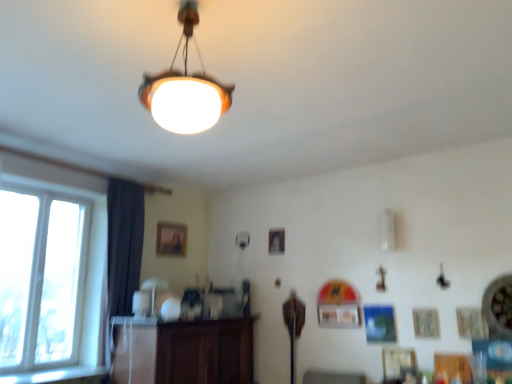
The image size is (512, 384). What do you see at coordinates (154, 289) in the screenshot? I see `matte white lampshade at center, arranged as the 2th lamp when viewed from the right` at bounding box center [154, 289].

At what (x,y) coordinates should I click in order to perform the action: click on brown wooden dresser at center. Please return your answer as a coordinate pair (x, y). This screenshot has width=512, height=384. Looking at the image, I should click on (183, 351).

Describe the element at coordinates (49, 271) in the screenshot. I see `white glass window at left` at that location.

At what (x,y) coordinates should I click in order to perform the action: click on matte glass lampshade at upper center, which is the 2th lamp from left to right. Please return your answer as a coordinate pair (x, y). Looking at the image, I should click on (185, 89).

From the picture: Can you confirm if brown wooden dresser at center is bigger than white glass window at left?

Yes, brown wooden dresser at center is bigger than white glass window at left.

Considering the relative sizes of brown wooden dresser at center and white glass window at left in the image provided, is brown wooden dresser at center shorter than white glass window at left?

Correct, brown wooden dresser at center is not as tall as white glass window at left.

From a real-world perspective, is brown wooden dresser at center located beneath white glass window at left?

Yes, from a real-world perspective, brown wooden dresser at center is below white glass window at left.

Is wooden frame at center spatially inside brown wooden dresser at center, or outside of it?

wooden frame at center is located beyond the bounds of brown wooden dresser at center.

Are wooden frame at center and brown wooden dresser at center located far from each other?

That's right, there is a large distance between wooden frame at center and brown wooden dresser at center.

Considering the sizes of objects wooden frame at center and brown wooden dresser at center in the image provided, who is smaller, wooden frame at center or brown wooden dresser at center?

wooden frame at center.

Where is `window in front of the wooden frame at center`? window in front of the wooden frame at center is located at coordinates (49, 271).

Considering the positions of point (174, 239) and point (7, 308), is point (174, 239) closer or farther from the camera than point (7, 308)?

Point (174, 239) appears to be farther away from the viewer than point (7, 308).

Is wooden frame at center to the right of white glass window at left from the viewer's perspective?

Yes, wooden frame at center is to the right of white glass window at left.

Is wooden frame at center oriented towards white glass window at left?

No, wooden frame at center is not turned towards white glass window at left.

Is wooden frame at center smaller than dark fabric curtain at left?

Indeed, wooden frame at center has a smaller size compared to dark fabric curtain at left.

Which is behind, wooden frame at center or dark fabric curtain at left?

wooden frame at center is further away from the camera.

Considering the relative sizes of wooden frame at center and dark fabric curtain at left in the image provided, is wooden frame at center thinner than dark fabric curtain at left?

Yes.

Looking at this image, would you say wooden frame at center is inside or outside dark fabric curtain at left?

wooden frame at center exists outside the volume of dark fabric curtain at left.

Is white glass window at left oriented away from matte glass lampshade at upper center, which ranks as the 1th lamp in front-to-back order?

white glass window at left is not turned away from matte glass lampshade at upper center, which ranks as the 1th lamp in front-to-back order.

Considering the relative sizes of white glass window at left and matte glass lampshade at upper center, which is the 1th lamp from right to left, in the image provided, is white glass window at left wider than matte glass lampshade at upper center, which is the 1th lamp from right to left,?

No, white glass window at left is not wider than matte glass lampshade at upper center, which is the 1th lamp from right to left.

How many degrees apart are the facing directions of white glass window at left and matte glass lampshade at upper center, which is the 2th lamp from left to right?

90.5 degrees.

Based on the photo, from the image's perspective, is matte glass lampshade at upper center, which ranks as the 1th lamp in front-to-back order, located above or below brown wooden dresser at center?

matte glass lampshade at upper center, which ranks as the 1th lamp in front-to-back order, is above brown wooden dresser at center.

Based on the photo, considering the sizes of objects matte glass lampshade at upper center, which ranks as the 1th lamp in front-to-back order, and brown wooden dresser at center in the image provided, who is bigger, matte glass lampshade at upper center, which ranks as the 1th lamp in front-to-back order, or brown wooden dresser at center?

brown wooden dresser at center.

How many degrees apart are the facing directions of matte glass lampshade at upper center, placed as the second lamp when sorted from bottom to top, and brown wooden dresser at center?

89.3 degrees separate the facing orientations of matte glass lampshade at upper center, placed as the second lamp when sorted from bottom to top, and brown wooden dresser at center.

Between point (182, 125) and point (126, 348), which one is positioned in front?

The point (182, 125) is closer.

From a real-world perspective, which object rests below the other?

From a 3D spatial view, white glass window at left is below.

From the picture: Which object is wider, matte glass lampshade at upper center, placed as the second lamp when sorted from bottom to top, or white glass window at left?

matte glass lampshade at upper center, placed as the second lamp when sorted from bottom to top, is wider.

Does matte glass lampshade at upper center, which is the 1th lamp from right to left, have a lesser height compared to white glass window at left?

Yes, matte glass lampshade at upper center, which is the 1th lamp from right to left, is shorter than white glass window at left.

How different are the orientations of matte glass lampshade at upper center, which appears as the first lamp when viewed from the top, and white glass window at left in degrees?

The angular difference between matte glass lampshade at upper center, which appears as the first lamp when viewed from the top, and white glass window at left is 90.5 degrees.

Identify the location of window in front of the brown wooden dresser at center. The height and width of the screenshot is (384, 512). (49, 271).

At what (x,y) coordinates should I click in order to perform the action: click on picture frame behind the brown wooden dresser at center. Please return your answer as a coordinate pair (x, y). Looking at the image, I should click on (170, 239).

Looking at the image, which one is located closer to white glass window at left, matte glass lampshade at upper center, the second lamp in the back-to-front sequence, or dark fabric curtain at left?

dark fabric curtain at left is closer to white glass window at left.

From the image, which object appears to be nearer to matte white lampshade at center, the first lamp viewed from the back, dark fabric curtain at left or brown wooden dresser at center?

Based on the image, dark fabric curtain at left appears to be nearer to matte white lampshade at center, the first lamp viewed from the back.

When comparing their distances from matte white lampshade at center, the first lamp viewed from the back, does brown wooden dresser at center or dark fabric curtain at left seem closer?

Among the two, dark fabric curtain at left is located nearer to matte white lampshade at center, the first lamp viewed from the back.

Considering their positions, is brown wooden dresser at center positioned further to matte glass lampshade at upper center, the second lamp in the back-to-front sequence, than matte white lampshade at center, arranged as the 2th lamp when viewed from the right?

Among the two, matte white lampshade at center, arranged as the 2th lamp when viewed from the right, is located further to matte glass lampshade at upper center, the second lamp in the back-to-front sequence.

Looking at the image, which one is located closer to matte white lampshade at center, acting as the 2th lamp starting from the front, dark fabric curtain at left or wooden frame at center?

Based on the image, dark fabric curtain at left appears to be nearer to matte white lampshade at center, acting as the 2th lamp starting from the front.

From the image, which object appears to be farther from matte white lampshade at center, the first lamp from the bottom, wooden frame at center or brown wooden dresser at center?

wooden frame at center.

Looking at this image, based on their spatial positions, is dark fabric curtain at left or matte white lampshade at center, which is counted as the 2th lamp, starting from the top, further from wooden frame at center?

matte white lampshade at center, which is counted as the 2th lamp, starting from the top, is further to wooden frame at center.

Based on their spatial positions, is brown wooden dresser at center or wooden frame at center further from dark fabric curtain at left?

wooden frame at center is further to dark fabric curtain at left.

Locate an element on the screen. dresser between matte glass lampshade at upper center, which is the 1th lamp from right to left, and dark fabric curtain at left in the front-back direction is located at coordinates (183, 351).

The image size is (512, 384). I want to click on dresser located between matte glass lampshade at upper center, which ranks as the 1th lamp in front-to-back order, and matte white lampshade at center, the first lamp viewed from the back, in the depth direction, so click(x=183, y=351).

Image resolution: width=512 pixels, height=384 pixels. Identify the location of curtain positioned between matte glass lampshade at upper center, the second lamp in the back-to-front sequence, and wooden frame at center from near to far. (122, 252).

The width and height of the screenshot is (512, 384). In order to click on curtain between white glass window at left and wooden frame at center along the z-axis in this screenshot , I will do `click(122, 252)`.